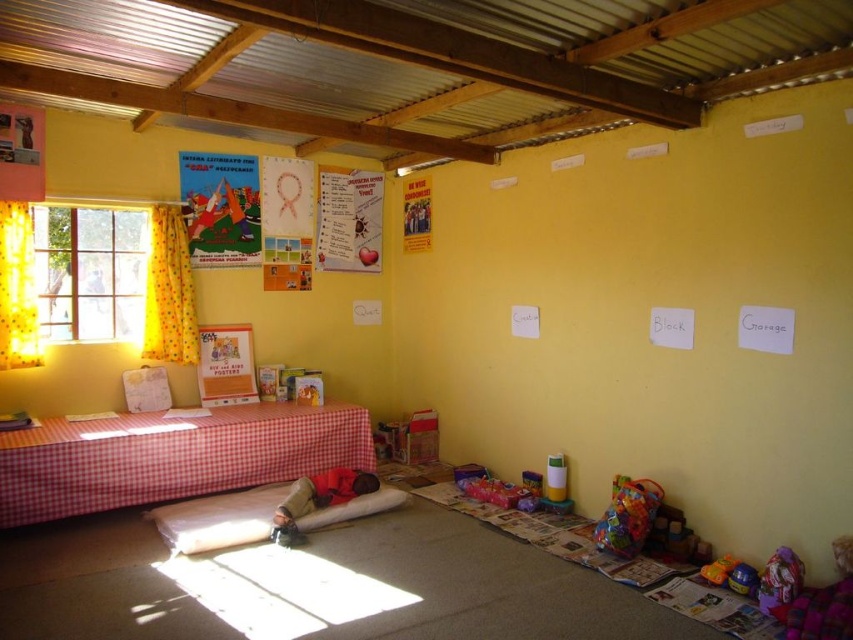
Measure the distance between red checkered fabric bed at lower left and camera.

The distance of red checkered fabric bed at lower left from camera is 11.52 feet.

Between point (33, 481) and point (238, 189), which one is positioned in front?

Point (33, 481)

Between point (148, 445) and point (190, 240), which one is positioned behind?

Point (190, 240)

You are a GUI agent. You are given a task and a screenshot of the screen. Output one action in this format:
    pyautogui.click(x=<x>, y=<y>)
    Task: Click on the red checkered fabric bed at lower left
    
    Given the screenshot: What is the action you would take?
    pyautogui.click(x=171, y=456)

Can you confirm if red checkered fabric bed at lower left is bigger than multicolored fabric bag at lower right?

Yes.

Which is behind, point (234, 449) or point (630, 484)?

Point (234, 449)

This screenshot has height=640, width=853. Find the location of `red checkered fabric bed at lower left`. red checkered fabric bed at lower left is located at coordinates (171, 456).

Can you confirm if red checkered fabric bed at lower left is positioned above matte cardboard poster at center?

Actually, red checkered fabric bed at lower left is below matte cardboard poster at center.

Is red checkered fabric bed at lower left wider than matte cardboard poster at center?

Yes, red checkered fabric bed at lower left is wider than matte cardboard poster at center.

Is point (68, 468) positioned in front of point (231, 330)?

Yes, point (68, 468) is closer to viewer.

This screenshot has width=853, height=640. I want to click on red checkered fabric bed at lower left, so [x=171, y=456].